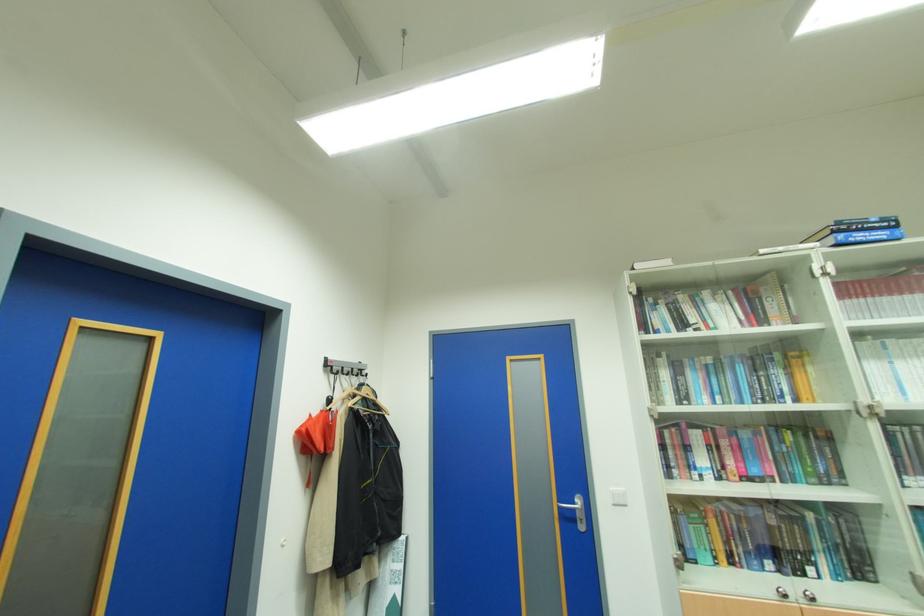
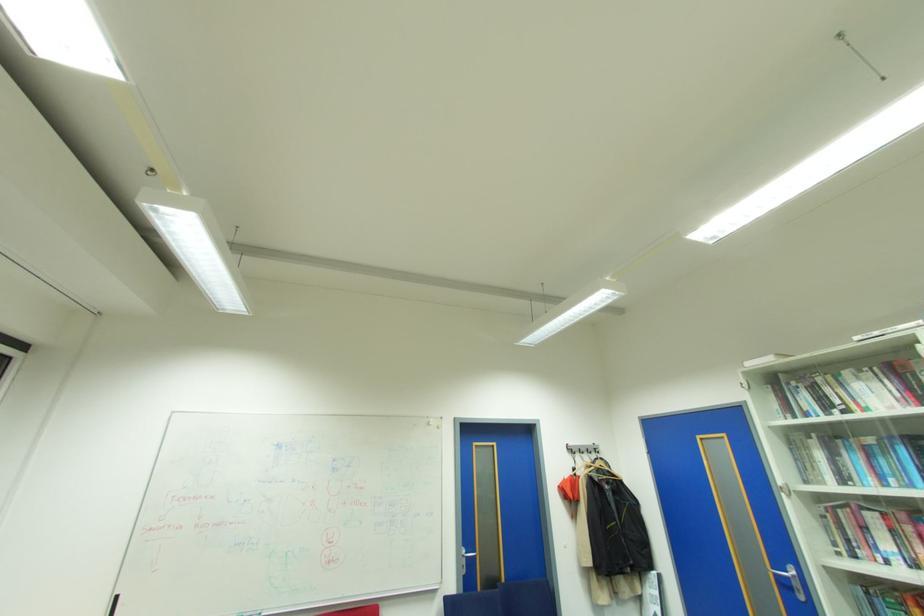
Locate, in the second image, the point that corresponds to pixel 689 361 in the first image.

(843, 442)